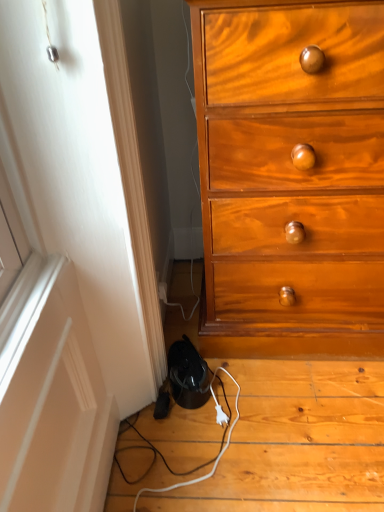
You are a GUI agent. You are given a task and a screenshot of the screen. Output one action in this format:
    pyautogui.click(x=<x>, y=<y>)
    Task: Click on the black plastic bag at lower left
    
    Given the screenshot: What is the action you would take?
    pyautogui.click(x=297, y=439)

This screenshot has width=384, height=512. Describe the element at coordinates (297, 439) in the screenshot. I see `black plastic bag at lower left` at that location.

The height and width of the screenshot is (512, 384). In order to click on black plastic bag at lower left in this screenshot , I will do `click(297, 439)`.